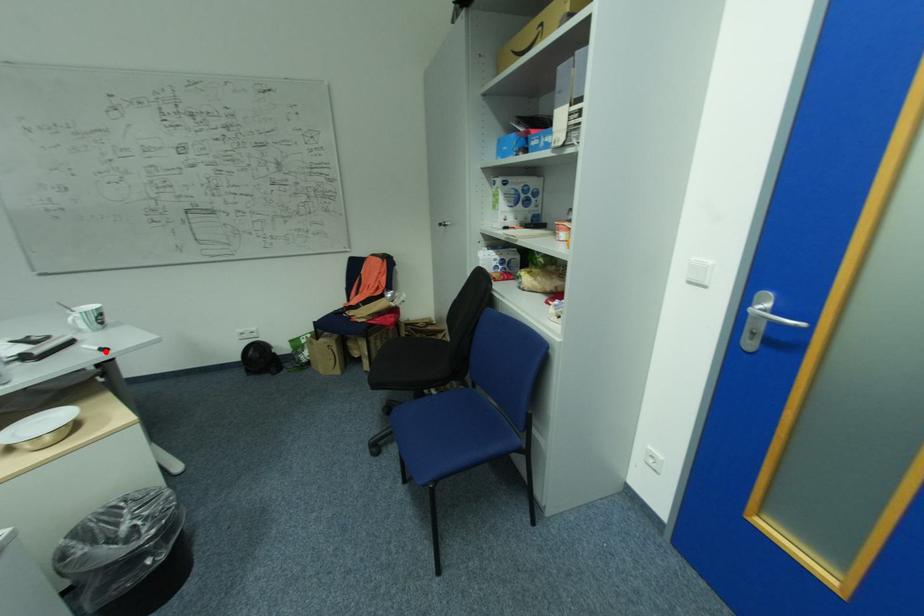
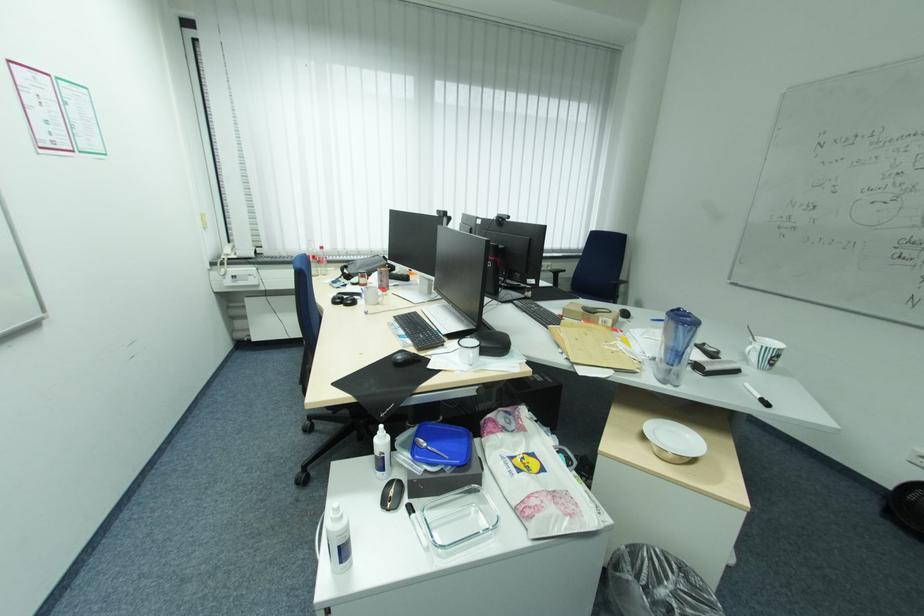
Where in the second image is the point corresponding to the highlighted location from the first image?

(763, 400)